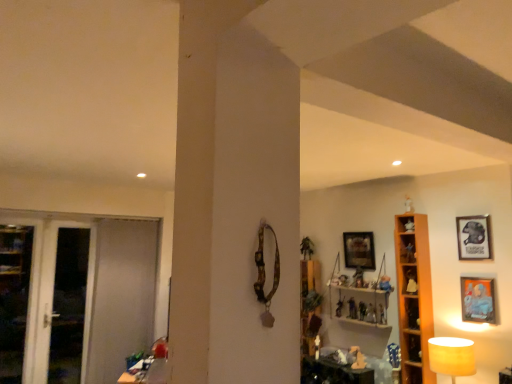
Locate an element on the screen. The width and height of the screenshot is (512, 384). blank space situated above white fabric screen door at left, which is the 1th screen door from right to left (from a real-world perspective) is located at coordinates point(126,218).